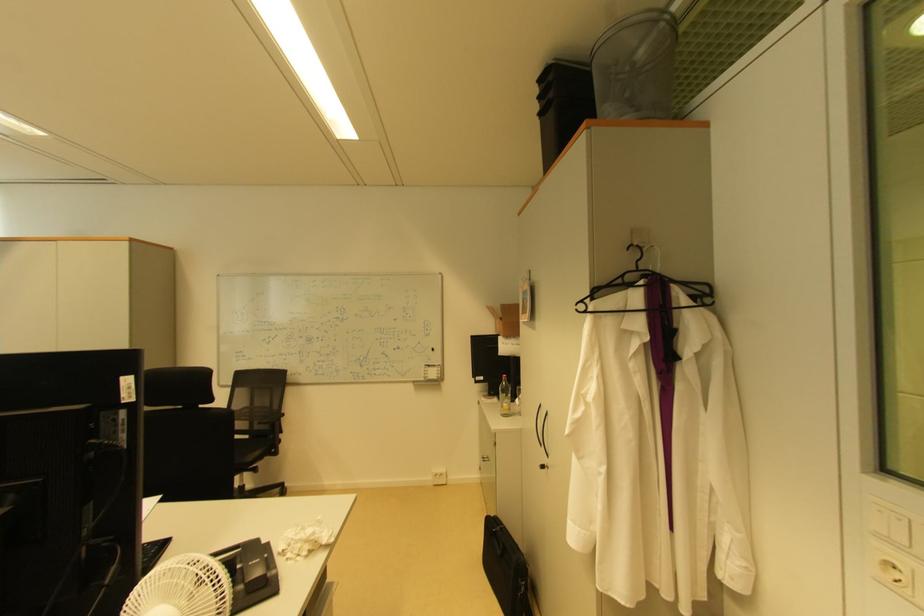
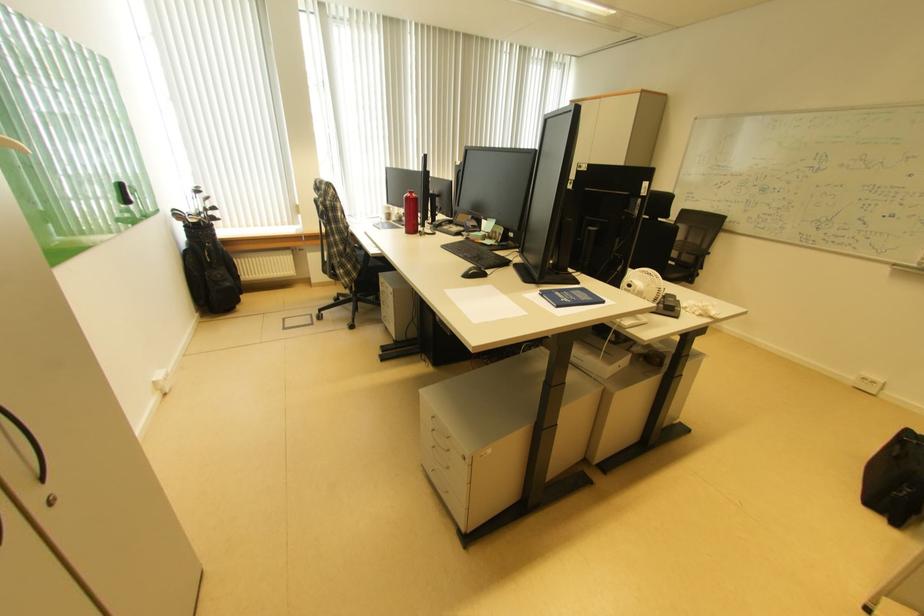
The point at (254, 586) is marked in the first image. Where is the corresponding point in the second image?

(673, 306)